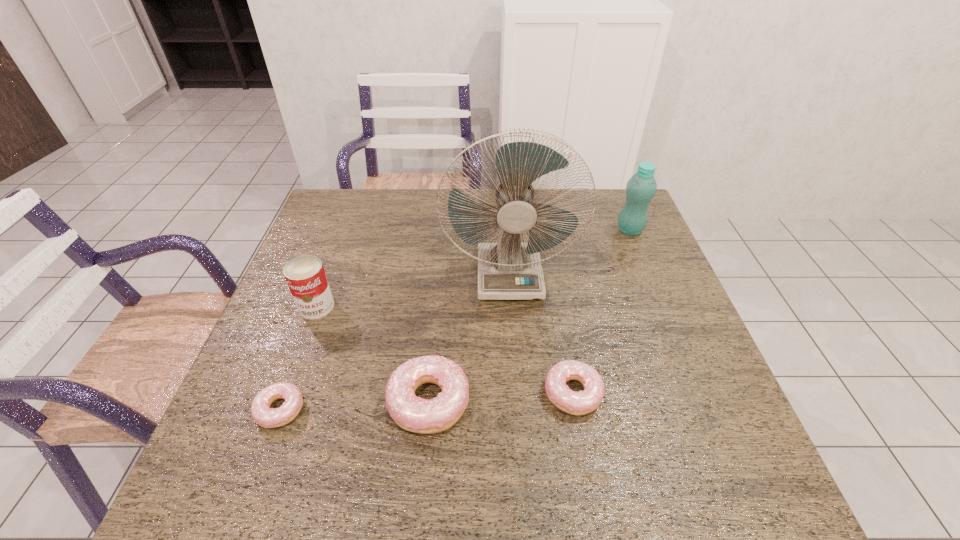
Locate an element on the screen. The height and width of the screenshot is (540, 960). unoccupied area between the rightmost doughnut and the can is located at coordinates (444, 349).

Where is `vacant space in between the can and the rightmost object`? This screenshot has height=540, width=960. vacant space in between the can and the rightmost object is located at coordinates (473, 268).

You are a GUI agent. You are given a task and a screenshot of the screen. Output one action in this format:
    pyautogui.click(x=<x>, y=<y>)
    Task: Click on the unoccupied position between the second doughnut from left to right and the fan
    Image resolution: width=960 pixels, height=540 pixels.
    Given the screenshot: What is the action you would take?
    pyautogui.click(x=469, y=339)

The image size is (960, 540). What are the coordinates of `vacant area between the second tallest doughnut and the fan` in the screenshot? It's located at (541, 334).

Find the location of a particular element. vacant area between the second shortest doughnut and the tallest doughnut is located at coordinates (501, 397).

Locate an element on the screen. vacant area that lies between the second shortest doughnut and the fourth shortest object is located at coordinates (444, 349).

Image resolution: width=960 pixels, height=540 pixels. I want to click on free spot between the third tallest object and the fan, so click(x=413, y=291).

In order to click on vacant area that lies between the tallest object and the rightmost doughnut in this screenshot , I will do `click(541, 334)`.

Locate an element on the screen. the second closest object relative to the fifth shortest object is located at coordinates (582, 402).

The image size is (960, 540). I want to click on the fourth closest object relative to the shortest object, so click(x=582, y=402).